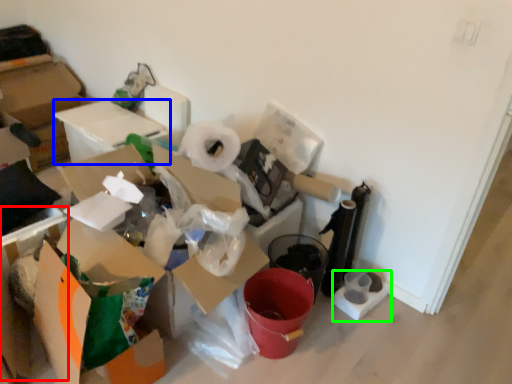
Question: Considering the real-world distances, which object is closest to cardboard box (highlighted by a red box)? cardboard box (highlighted by a blue box) or toilet paper (highlighted by a green box).

Choices:
 (A) cardboard box
 (B) toilet paper

Answer: (A)